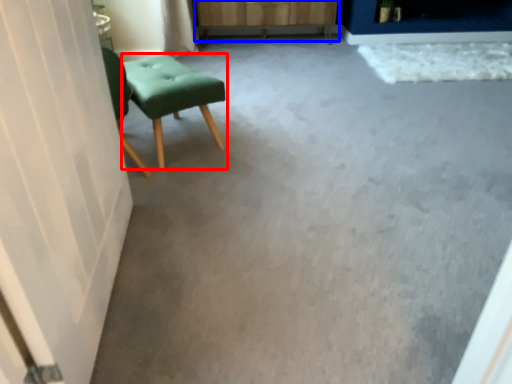
Question: Which object is closer to the camera taking this photo, stool (highlighted by a red box) or dresser (highlighted by a blue box)?

Choices:
 (A) stool
 (B) dresser

Answer: (A)